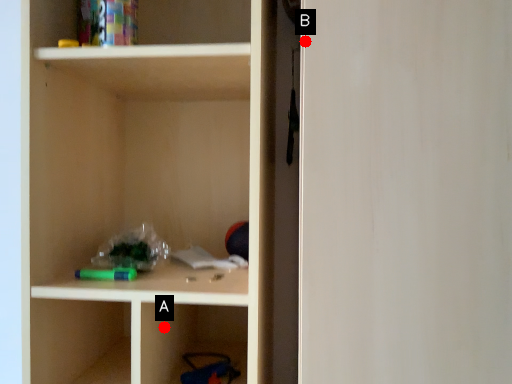
Question: Two points are circled on the image, labeled by A and B beside each circle. Which point appears closest to the camera in this image?

Choices:
 (A) A is closer
 (B) B is closer

Answer: (B)